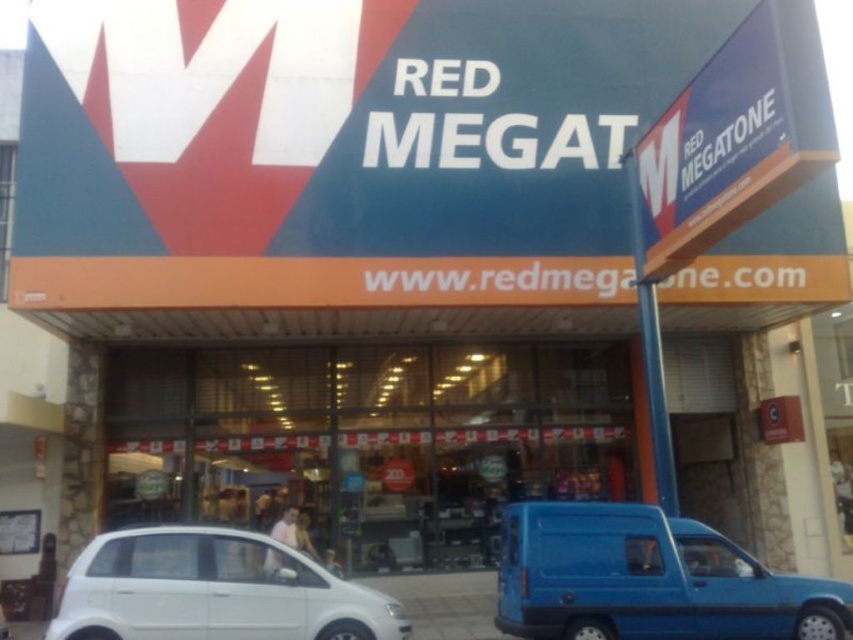
You are a delivery person who needs to park your truck, which is 2 meters wide, in front of the RED MEGATONE store. There are two vehicles parked nearby. The blue matte van at lower right and the white matte hatchback at lower left. Based on their positions, can you determine if there is enough space between them to park your truck?

The blue matte van at lower right might be wider than white matte hatchback at lower left. Since the truck is 2 meters wide, but the exact width of the space between the two vehicles is unknown, it is uncertain if there is enough space to park the truck safely.

Looking at this image, you are standing at the entrance of the store and want to park your car in the parking lot. The parking lot has a designated parking spot at point 0.906, 0.761. Is the blue matte van at lower right currently occupying that parking spot?

The blue matte van at lower right is located at point [648,579], so yes, the blue matte van at lower right is occupying that parking spot.

You are a customer arriving at the RED MEGATONE store and need to park your car. You see a blue matte van at lower right and a white matte hatchback at lower left. Which parking spot is currently available for you to park in?

The white matte hatchback at lower left is behind the blue matte van at lower right, so the parking spot in front of the blue matte van at lower right is available for you to park there.